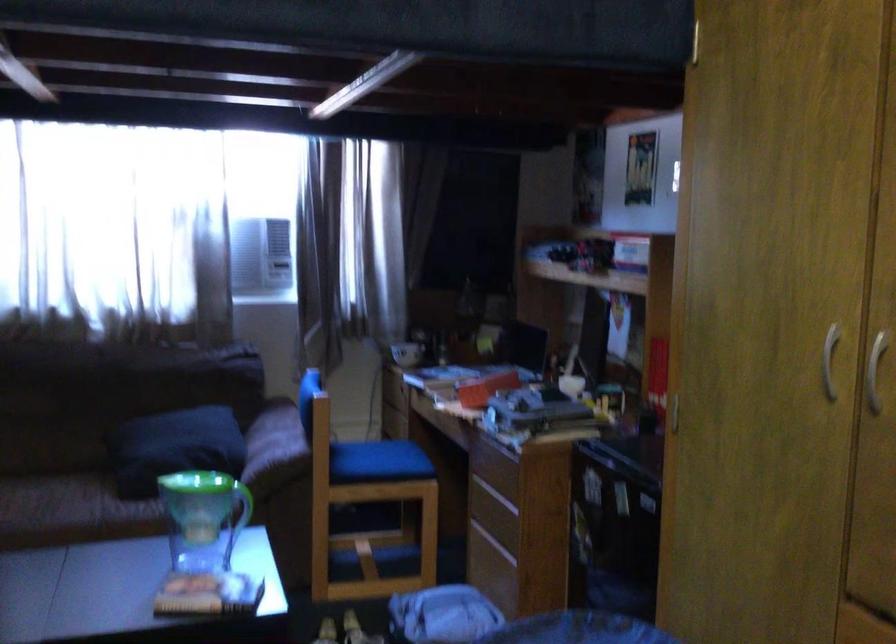
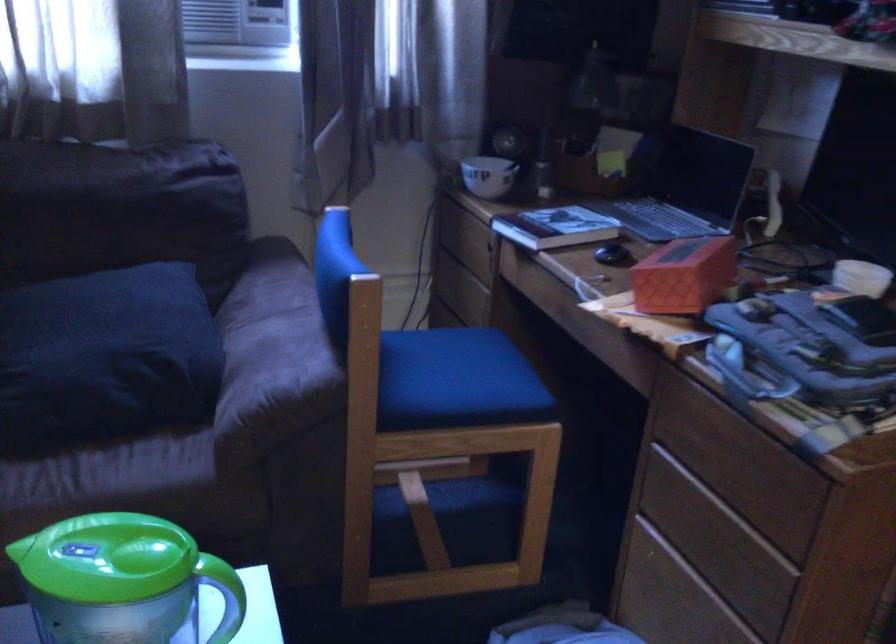
Where in the second image is the point corresponding to point 195,484 from the first image?

(106, 558)